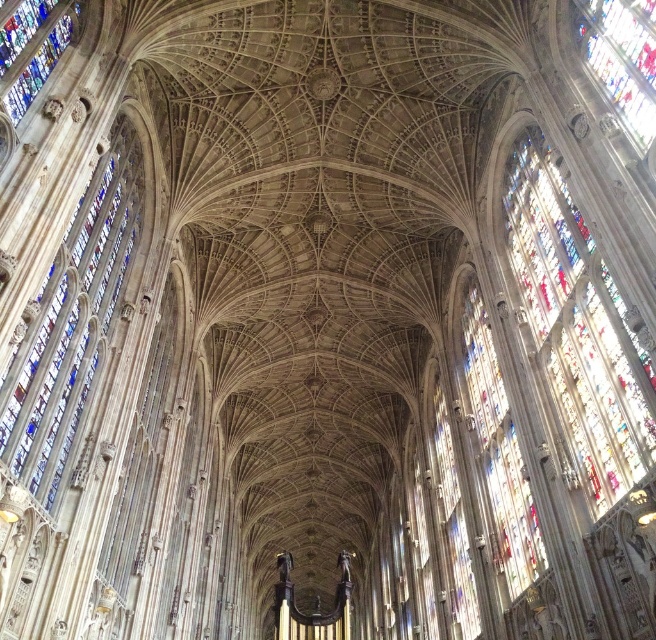
Question: Which point is farther from the camera taking this photo?

Choices:
 (A) (602, 83)
 (B) (51, 378)
 (C) (516, 451)
 (D) (455, 602)

Answer: (D)

Question: Among these objects, which one is nearest to the camera?

Choices:
 (A) transparent stained glass at right
 (B) multicolored stained glass at right
 (C) stained glass window at upper right

Answer: (C)

Question: Can you confirm if stained glass window at right is positioned to the right of multicolored stained glass at right?

Choices:
 (A) no
 (B) yes

Answer: (B)

Question: Can you confirm if multicolored stained glass at right is wider than stained glass window at upper right?

Choices:
 (A) yes
 (B) no

Answer: (A)

Question: Does stained glass window at right come behind stained glass window at upper right?

Choices:
 (A) yes
 (B) no

Answer: (B)

Question: Considering the real-world distances, which object is closest to the stained glass window at left?

Choices:
 (A) stained glass window at upper left
 (B) stained glass window at upper right

Answer: (A)